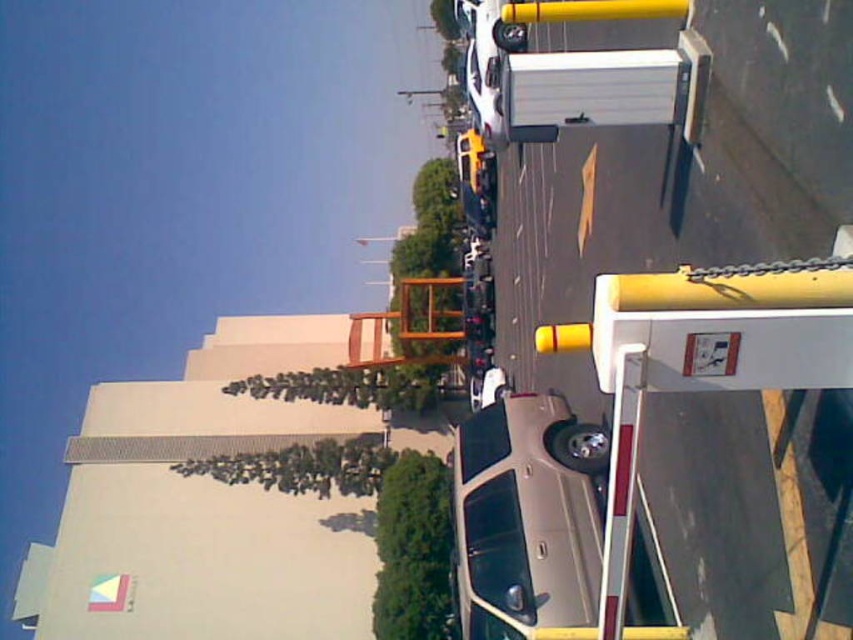
You are a delivery driver trying to park your 6 feet tall truck. You see a satin silver sedan at center and a yellow matte traffic light at center. Which object is taller than your truck?

The satin silver sedan at center is taller than your truck since it has a greater height compared to the yellow matte traffic light at center, and the traffic light is shorter than the sedan.

You are a pedestrian standing at the yellow matte traffic light at center and want to cross the street to reach the satin silver sedan at center. Given that the crosswalk is 10 feet wide, can you safely cross the street to the sedan without stepping outside the crosswalk?

The satin silver sedan at center and yellow matte traffic light at center are 10.04 feet apart from each other. Since the crosswalk is 10 feet wide, the distance between them is slightly wider than the crosswalk, so you cannot safely cross to the sedan without stepping outside the crosswalk.

You are a pedestrian standing at the crosswalk near the satin silver sedan at center and the yellow matte traffic light at center. Which object is closer to the ground?

The satin silver sedan at center is closer to the ground because it is positioned below the yellow matte traffic light at center.